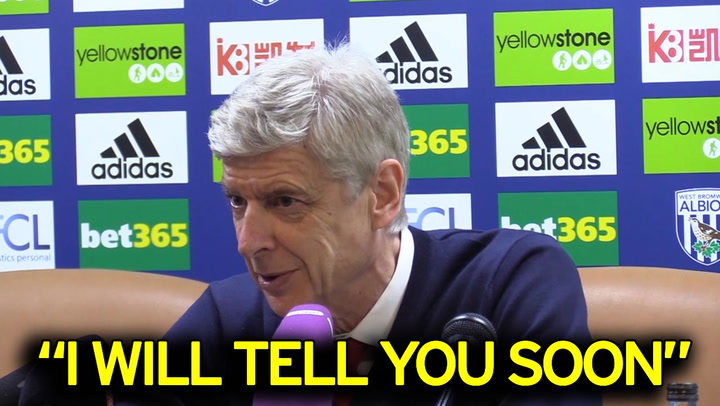
Where is `couch`? This screenshot has height=406, width=720. couch is located at coordinates (626, 322).